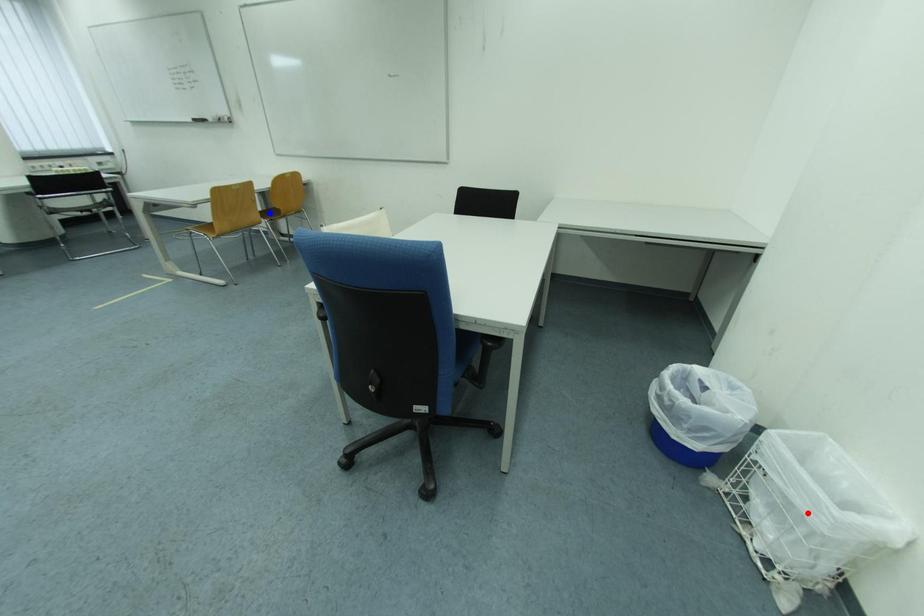
Question: In the image, two points are highlighted. Which point is nearer to the camera? Reply with the corresponding letter.

Choices:
 (A) blue point
 (B) red point

Answer: (B)